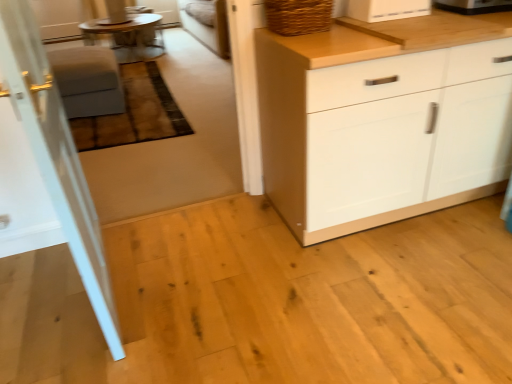
Find the location of a particular element. woven brown basket at upper right is located at coordinates (298, 16).

Identify the location of black plastic toaster at upper right, which is counted as the 1th appliance, starting from the right. This screenshot has width=512, height=384. (473, 6).

At what (x,y) coordinates should I click in order to perform the action: click on white glossy toaster at upper center, placed as the 1th appliance when sorted from left to right. Please return your answer as a coordinate pair (x, y). Looking at the image, I should click on (386, 9).

Image resolution: width=512 pixels, height=384 pixels. Identify the location of screen door that is below the wooden round table at upper left (from the image's perspective). (56, 156).

From the picture: From the image's perspective, between wooden round table at upper left and white glossy door at left, which one is located above?

wooden round table at upper left appears higher in the image.

Between wooden round table at upper left and white glossy door at left, which one is positioned in front?

Positioned in front is white glossy door at left.

How many degrees apart are the facing directions of wooden round table at upper left and white glossy door at left?

92.2 degrees.

Can we say woven brown basket at upper right lies outside black plastic toaster at upper right, which is counted as the 1th appliance, starting from the right?

Yes, woven brown basket at upper right is outside of black plastic toaster at upper right, which is counted as the 1th appliance, starting from the right.

Can you confirm if woven brown basket at upper right is taller than black plastic toaster at upper right, which is the second appliance from left to right?

Yes, woven brown basket at upper right is taller than black plastic toaster at upper right, which is the second appliance from left to right.

From a real-world perspective, which is physically above, woven brown basket at upper right or black plastic toaster at upper right, which is the second appliance from left to right?

In real-world perspective, woven brown basket at upper right is above.

How much distance is there between woven brown basket at upper right and black plastic toaster at upper right, which is counted as the 1th appliance, starting from the right?

woven brown basket at upper right is 22.42 inches from black plastic toaster at upper right, which is counted as the 1th appliance, starting from the right.

Is white matte cabinet at center turned away from wooden round table at upper left?

Yes, white matte cabinet at center is positioned with its back facing wooden round table at upper left.

Is white matte cabinet at center bigger than wooden round table at upper left?

Correct, white matte cabinet at center is larger in size than wooden round table at upper left.

Where is `chest of drawers lying on the right of wooden round table at upper left`? The height and width of the screenshot is (384, 512). chest of drawers lying on the right of wooden round table at upper left is located at coordinates (384, 119).

From a real-world perspective, which is physically above, white matte cabinet at center or wooden round table at upper left?

white matte cabinet at center.

Is the surface of matte gray stool at left in direct contact with white matte cabinet at center?

No, matte gray stool at left is not in contact with white matte cabinet at center.

Does point (69, 79) lie in front of point (372, 154)?

No, it is not.

Between matte gray stool at left and white matte cabinet at center, which one has larger size?

With larger size is white matte cabinet at center.

Between white glossy door at left and white matte cabinet at center, which one appears on the left side from the viewer's perspective?

Positioned to the left is white glossy door at left.

Is point (75, 187) in front of point (379, 192)?

Yes, point (75, 187) is in front of point (379, 192).

Does white glossy door at left have a smaller size compared to white matte cabinet at center?

Yes.

From the image's perspective, who appears lower, white glossy door at left or white matte cabinet at center?

white glossy door at left appears lower in the image.

How many degrees apart are the facing directions of matte gray stool at left and white glossy toaster at upper center, which appears as the 2th appliance when viewed from the right?

The angle between the facing direction of matte gray stool at left and the facing direction of white glossy toaster at upper center, which appears as the 2th appliance when viewed from the right, is 3.19 degrees.

Consider the image. In terms of width, does matte gray stool at left look wider or thinner when compared to white glossy toaster at upper center, placed as the 1th appliance when sorted from left to right?

matte gray stool at left is wider than white glossy toaster at upper center, placed as the 1th appliance when sorted from left to right.

Does matte gray stool at left have a smaller size compared to white glossy toaster at upper center, which appears as the 2th appliance when viewed from the right?

Actually, matte gray stool at left might be larger than white glossy toaster at upper center, which appears as the 2th appliance when viewed from the right.

Can you confirm if wooden round table at upper left is taller than black plastic toaster at upper right, which is the second appliance from left to right?

Indeed, wooden round table at upper left has a greater height compared to black plastic toaster at upper right, which is the second appliance from left to right.

Between point (152, 40) and point (499, 9), which one is positioned in front?

The point (499, 9) is closer to the camera.

Considering the sizes of objects wooden round table at upper left and black plastic toaster at upper right, which is counted as the 1th appliance, starting from the right, in the image provided, who is wider, wooden round table at upper left or black plastic toaster at upper right, which is counted as the 1th appliance, starting from the right,?

With larger width is wooden round table at upper left.

How distant is wooden round table at upper left from black plastic toaster at upper right, which is the second appliance from left to right?

The distance of wooden round table at upper left from black plastic toaster at upper right, which is the second appliance from left to right, is 15.06 feet.

Locate an element on the screen. Image resolution: width=512 pixels, height=384 pixels. table below the white glossy door at left (from a real-world perspective) is located at coordinates (129, 37).

From the image's perspective, which appliance is the 2nd one above the woven brown basket at upper right? Please provide its 2D coordinates.

[(473, 6)]

Estimate the real-world distances between objects in this image. Which object is closer to white glossy door at left, matte gray stool at left or wooden round table at upper left?

Based on the image, matte gray stool at left appears to be nearer to white glossy door at left.

When comparing their distances from white matte cabinet at center, does white glossy door at left or white glossy toaster at upper center, which appears as the 2th appliance when viewed from the right, seem closer?

Among the two, white glossy toaster at upper center, which appears as the 2th appliance when viewed from the right, is located nearer to white matte cabinet at center.

When comparing their distances from black plastic toaster at upper right, which is the second appliance from left to right, does woven brown basket at upper right or white glossy toaster at upper center, which appears as the 2th appliance when viewed from the right, seem closer?

Among the two, white glossy toaster at upper center, which appears as the 2th appliance when viewed from the right, is located nearer to black plastic toaster at upper right, which is the second appliance from left to right.

From the image, which object appears to be farther from white matte cabinet at center, black plastic toaster at upper right, which is counted as the 1th appliance, starting from the right, or woven brown basket at upper right?

black plastic toaster at upper right, which is counted as the 1th appliance, starting from the right, is further to white matte cabinet at center.

Considering their positions, is white glossy door at left positioned further to black plastic toaster at upper right, which is counted as the 1th appliance, starting from the right, than matte gray stool at left?

Based on the image, matte gray stool at left appears to be further to black plastic toaster at upper right, which is counted as the 1th appliance, starting from the right.

From the image, which object appears to be nearer to wooden round table at upper left, white glossy toaster at upper center, which appears as the 2th appliance when viewed from the right, or black plastic toaster at upper right, which is counted as the 1th appliance, starting from the right?

Among the two, white glossy toaster at upper center, which appears as the 2th appliance when viewed from the right, is located nearer to wooden round table at upper left.

From the image, which object appears to be nearer to white glossy toaster at upper center, placed as the 1th appliance when sorted from left to right, matte gray stool at left or black plastic toaster at upper right, which is the second appliance from left to right?

Based on the image, black plastic toaster at upper right, which is the second appliance from left to right, appears to be nearer to white glossy toaster at upper center, placed as the 1th appliance when sorted from left to right.

Looking at the image, which one is located further to wooden round table at upper left, white glossy door at left or woven brown basket at upper right?

Based on the image, white glossy door at left appears to be further to wooden round table at upper left.

You are a GUI agent. You are given a task and a screenshot of the screen. Output one action in this format:
    pyautogui.click(x=<x>, y=<y>)
    Task: Click on the appliance between white glossy door at left and black plastic toaster at upper right, which is counted as the 1th appliance, starting from the right
    
    Given the screenshot: What is the action you would take?
    pyautogui.click(x=386, y=9)

The height and width of the screenshot is (384, 512). Identify the location of appliance between matte gray stool at left and white matte cabinet at center in the horizontal direction. coord(386,9).

Find the location of a particular element. basket between matte gray stool at left and white glossy toaster at upper center, which appears as the 2th appliance when viewed from the right, from left to right is located at coordinates (298, 16).

You are a GUI agent. You are given a task and a screenshot of the screen. Output one action in this format:
    pyautogui.click(x=<x>, y=<y>)
    Task: Click on the basket between white glossy door at left and matte gray stool at left in the front-back direction
    Image resolution: width=512 pixels, height=384 pixels.
    Given the screenshot: What is the action you would take?
    pyautogui.click(x=298, y=16)